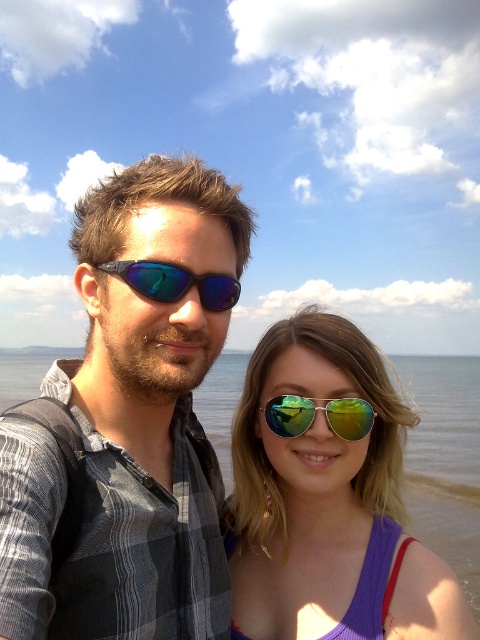
Looking at this image, you are a photographer trying to capture a closeup of the matte black sunglasses at center. The camera you are using has a focal length of 50mm and an aperture of f2.8. You want to ensure that the sunglasses are in focus while the background remains slightly blurred. Based on the provided coordinates, where exactly should you position the camera to achieve this effect?

Position the camera directly facing the matte black sunglasses at center located at coordinates point (128,422) to ensure they are in focus. The aperture of f2.8 will help blur the background.

You are a photographer trying to capture a clear shot of the clear water at center. However, the shiny reflective sunglasses at center are blocking your view. Can you move the sunglasses to get a better shot of the water?

The shiny reflective sunglasses at center is closer to the viewer than clear water at center, so moving the sunglasses would allow you to see the clear water at center behind them.